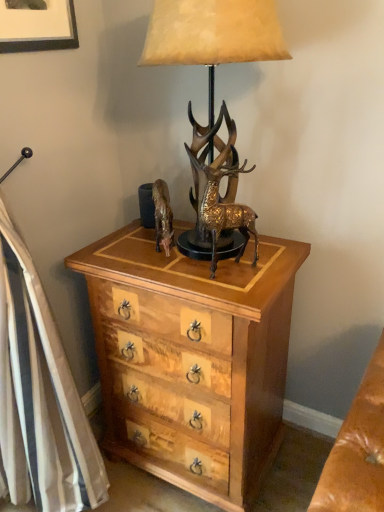
Identify the location of wooden chest of drawers at center. (192, 359).

Describe the element at coordinates (213, 35) in the screenshot. I see `metallic gold lamp at center` at that location.

The width and height of the screenshot is (384, 512). Describe the element at coordinates (218, 187) in the screenshot. I see `gold textured deer at center` at that location.

The width and height of the screenshot is (384, 512). I want to click on wooden chest of drawers at center, so click(192, 359).

Locate an element on the screen. Image resolution: width=384 pixels, height=512 pixels. deer positioned vertically above the wooden chest of drawers at center (from a real-world perspective) is located at coordinates (218, 187).

Is wooden chest of drawers at center thinner than gold textured deer at center?

No, wooden chest of drawers at center is not thinner than gold textured deer at center.

Does point (137, 414) lie behind point (223, 219)?

Yes, it is behind point (223, 219).

In the image, is wooden chest of drawers at center positioned in front of or behind gold textured deer at center?

wooden chest of drawers at center is behind gold textured deer at center.

Between wooden chest of drawers at center and gold metallic horse at center, which one appears on the right side from the viewer's perspective?

wooden chest of drawers at center.

From a real-world perspective, relative to gold metallic horse at center, is wooden chest of drawers at center vertically above or below?

From a real-world perspective, wooden chest of drawers at center is physically below gold metallic horse at center.

Would you say wooden chest of drawers at center is inside or outside gold metallic horse at center?

wooden chest of drawers at center is not enclosed by gold metallic horse at center.

Between wooden chest of drawers at center and gold metallic horse at center, which one has larger width?

wooden chest of drawers at center.

Is metallic gold lamp at center next to matte black picture frame at upper left?

No, metallic gold lamp at center is not making contact with matte black picture frame at upper left.

From a real-world perspective, relative to matte black picture frame at upper left, is metallic gold lamp at center vertically above or below?

metallic gold lamp at center is below matte black picture frame at upper left.

Based on the photo, considering the positions of objects metallic gold lamp at center and matte black picture frame at upper left in the image provided, who is more to the left, metallic gold lamp at center or matte black picture frame at upper left?

matte black picture frame at upper left.

From the picture: Is metallic gold lamp at center positioned beyond the bounds of matte black picture frame at upper left?

That's correct, metallic gold lamp at center is outside of matte black picture frame at upper left.

Looking at this image, does gold textured deer at center have a greater width compared to wooden chest of drawers at center?

No, gold textured deer at center is not wider than wooden chest of drawers at center.

In the image, is gold textured deer at center positioned in front of or behind wooden chest of drawers at center?

Clearly, gold textured deer at center is in front of wooden chest of drawers at center.

Can you confirm if gold textured deer at center is smaller than wooden chest of drawers at center?

Indeed, gold textured deer at center has a smaller size compared to wooden chest of drawers at center.

From the image's perspective, is gold textured deer at center positioned above or below wooden chest of drawers at center?

Clearly, from the image's perspective, gold textured deer at center is above wooden chest of drawers at center.

What's the angular difference between gold metallic horse at center and metallic gold lamp at center's facing directions?

40.5 degrees separate the facing orientations of gold metallic horse at center and metallic gold lamp at center.

Would you say gold metallic horse at center contains metallic gold lamp at center?

→ No, gold metallic horse at center does not contain metallic gold lamp at center.

From a real-world perspective, is gold metallic horse at center under metallic gold lamp at center?

Yes, from a real-world perspective, gold metallic horse at center is under metallic gold lamp at center.

Considering the relative sizes of gold metallic horse at center and metallic gold lamp at center in the image provided, is gold metallic horse at center taller than metallic gold lamp at center?

No, gold metallic horse at center is not taller than metallic gold lamp at center.

Locate an element on the screen. deer that appears in front of the gold metallic horse at center is located at coordinates (218, 187).

Would you consider gold metallic horse at center to be distant from gold textured deer at center?

Actually, gold metallic horse at center and gold textured deer at center are a little close together.

Does gold metallic horse at center appear on the left side of gold textured deer at center?

Yes, gold metallic horse at center is to the left of gold textured deer at center.

Is gold textured deer at center located outside gold metallic horse at center?

Yes, gold textured deer at center is located beyond the bounds of gold metallic horse at center.

In the image, is gold textured deer at center on the left side or the right side of gold metallic horse at center?

In the image, gold textured deer at center appears on the right side of gold metallic horse at center.

Is gold textured deer at center smaller than gold metallic horse at center?

No.

Does point (227, 196) appear closer or farther from the camera than point (168, 196)?

Clearly, point (227, 196) is closer to the camera than point (168, 196).

I want to click on deer above the wooden chest of drawers at center (from the image's perspective), so (218, 187).

Locate an element on the screen. The width and height of the screenshot is (384, 512). chest of drawers on the right of gold metallic horse at center is located at coordinates (192, 359).

Looking at the image, which one is located further to metallic gold lamp at center, gold metallic horse at center or gold textured deer at center?

The object further to metallic gold lamp at center is gold metallic horse at center.

When comparing their distances from gold textured deer at center, does metallic gold lamp at center or matte black picture frame at upper left seem closer?

Among the two, metallic gold lamp at center is located nearer to gold textured deer at center.

Consider the image. From the image, which object appears to be nearer to matte black picture frame at upper left, gold metallic horse at center or gold textured deer at center?

Among the two, gold metallic horse at center is located nearer to matte black picture frame at upper left.

Based on their spatial positions, is gold metallic horse at center or metallic gold lamp at center closer to wooden chest of drawers at center?

gold metallic horse at center lies closer to wooden chest of drawers at center than the other object.

Looking at the image, which one is located further to metallic gold lamp at center, matte black picture frame at upper left or wooden chest of drawers at center?

wooden chest of drawers at center.

Looking at the image, which one is located further to wooden chest of drawers at center, matte black picture frame at upper left or gold metallic horse at center?

matte black picture frame at upper left is further to wooden chest of drawers at center.

Which object lies nearer to the anchor point matte black picture frame at upper left, metallic gold lamp at center or gold metallic horse at center?

Based on the image, metallic gold lamp at center appears to be nearer to matte black picture frame at upper left.

Estimate the real-world distances between objects in this image. Which object is closer to matte black picture frame at upper left, gold textured deer at center or gold metallic horse at center?

gold metallic horse at center is closer to matte black picture frame at upper left.

This screenshot has width=384, height=512. In order to click on deer between metallic gold lamp at center and gold metallic horse at center from front to back in this screenshot , I will do `click(218, 187)`.

You are a GUI agent. You are given a task and a screenshot of the screen. Output one action in this format:
    pyautogui.click(x=<x>, y=<y>)
    Task: Click on the animal between metallic gold lamp at center and wooden chest of drawers at center vertically
    This screenshot has width=384, height=512.
    Given the screenshot: What is the action you would take?
    pyautogui.click(x=163, y=216)

The width and height of the screenshot is (384, 512). Identify the location of lamp between matte black picture frame at upper left and wooden chest of drawers at center from top to bottom. (213, 35).

What are the coordinates of `animal between matte black picture frame at upper left and gold textured deer at center in the up-down direction` in the screenshot? It's located at point(163,216).